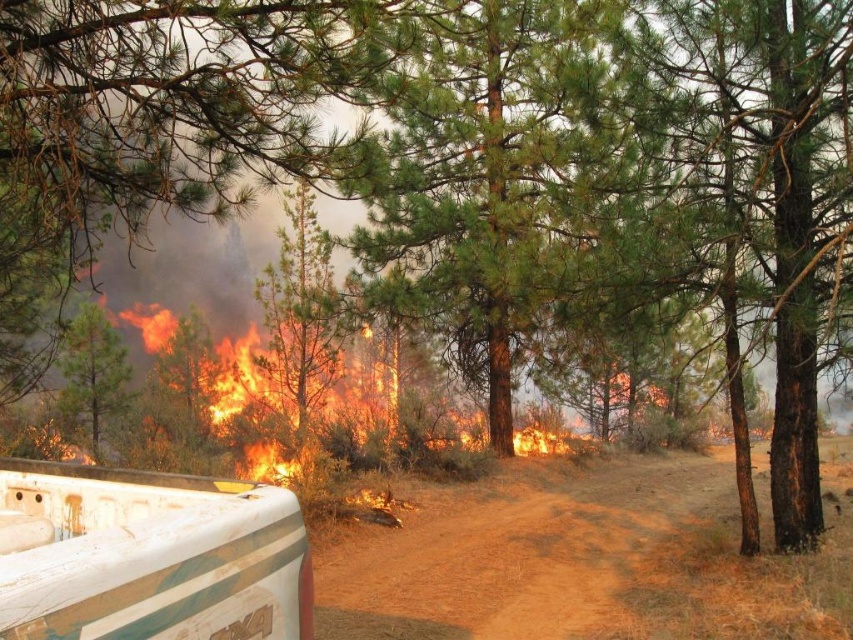
You are in a forest during a wildfire. You see a white pickup truck with green and brown stripes parked on a dirt path. There is a point at coordinates point (584, 563). Where is the brown dirt track at center located?

The brown dirt track at center is located at point (584, 563).